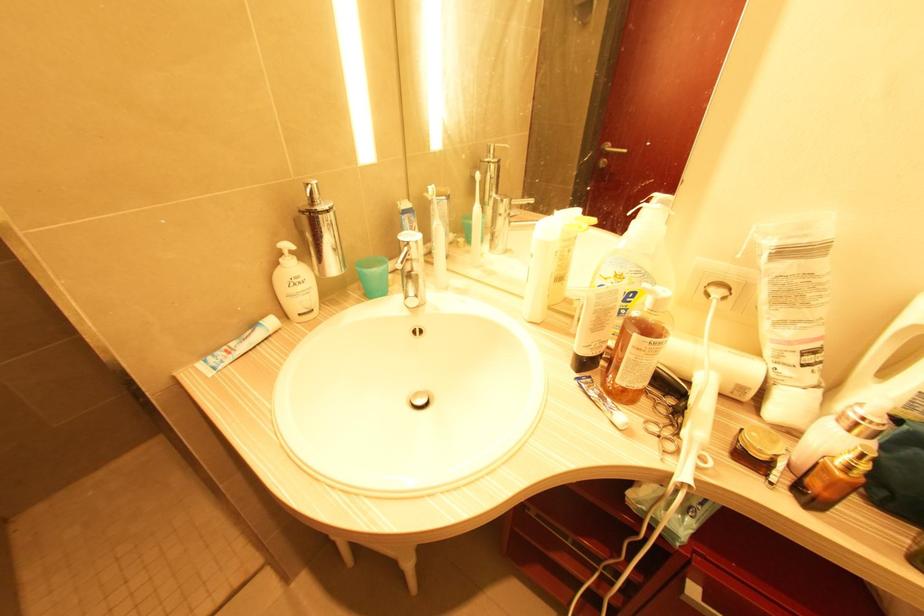
Locate an element on the screen. bottle dropper cap is located at coordinates (295, 285).